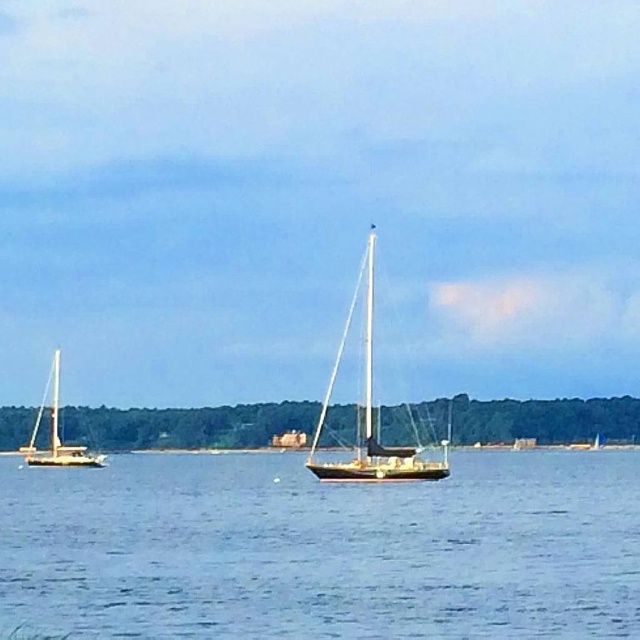
You are standing at the center of the image and see two points, point [38,545] and point [380,452]. Which point is closer to you?

Point [38,545] is in front of point [380,452], so it is closer to you.

You are a photographer planning to take a photo of the wooden sailboat at center and the wooden sailboat at left. Since both are in the frame, which one will appear closer to you in the photo?

The wooden sailboat at center will appear closer to you in the photo because it is positioned in front of the wooden sailboat at left.